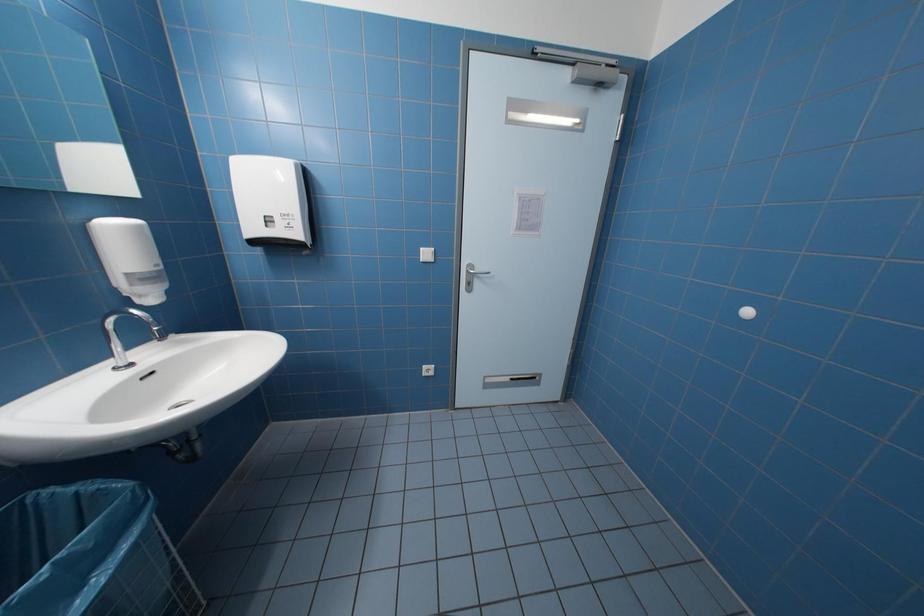
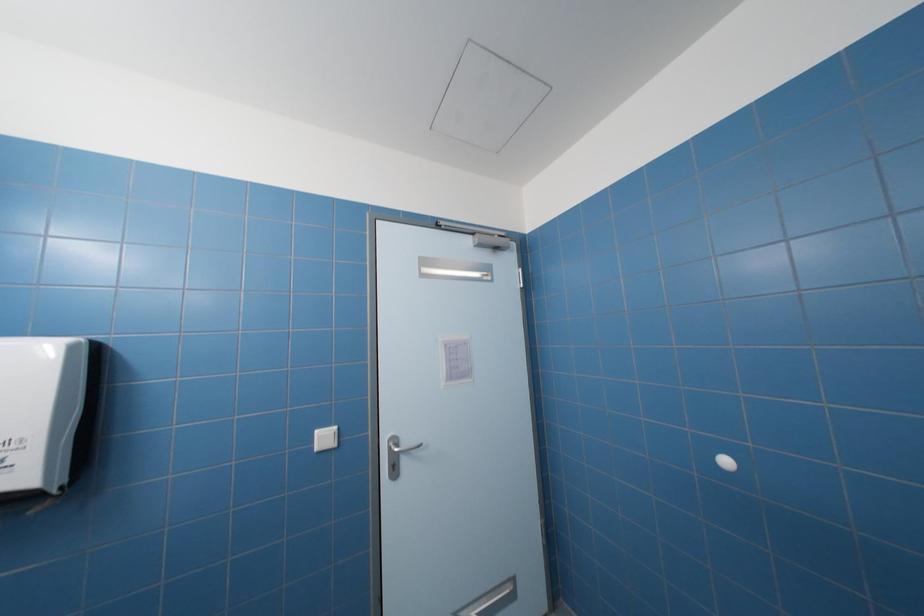
First-person continuous shooting, in which direction is the camera rotating?

The rotation direction of the camera is right-up.